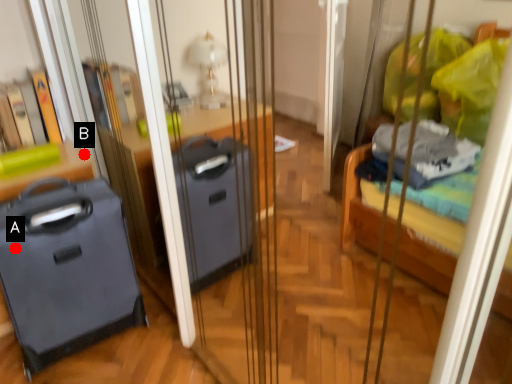
Question: Two points are circled on the image, labeled by A and B beside each circle. Which of the following is the closest to the observer?

Choices:
 (A) A is closer
 (B) B is closer

Answer: (A)